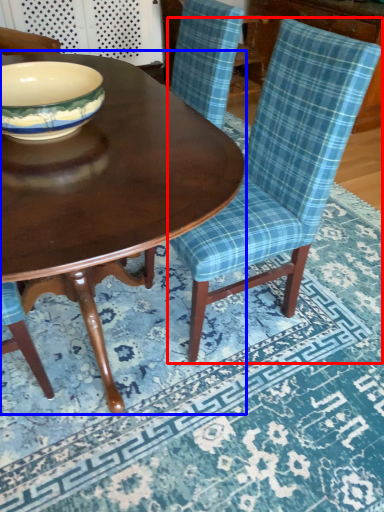
Question: Which object appears closest to the camera in this image, chair (highlighted by a red box) or coffee table (highlighted by a blue box)?

Choices:
 (A) chair
 (B) coffee table

Answer: (B)